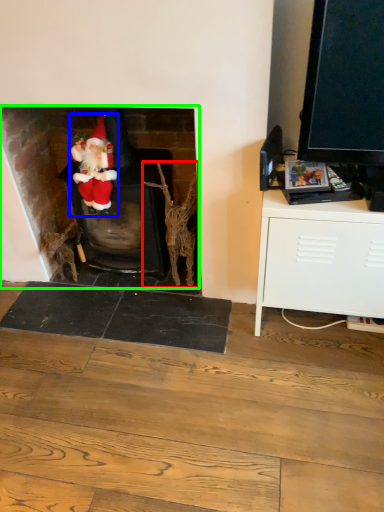
Question: Considering the real-world distances, which object is closest to branch (highlighted by a red box)? person (highlighted by a blue box) or fireplace (highlighted by a green box).

Choices:
 (A) person
 (B) fireplace

Answer: (A)